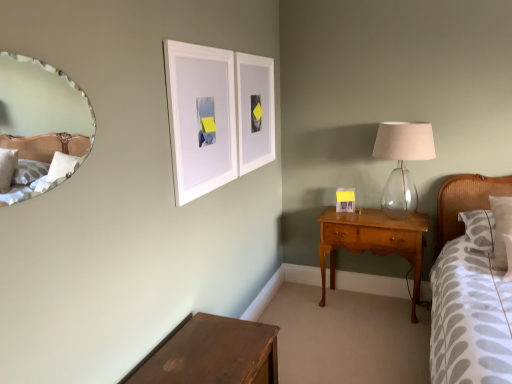
Where is `empty space that is ontop of dark brown wooden table at lower left`? This screenshot has height=384, width=512. empty space that is ontop of dark brown wooden table at lower left is located at coordinates click(211, 347).